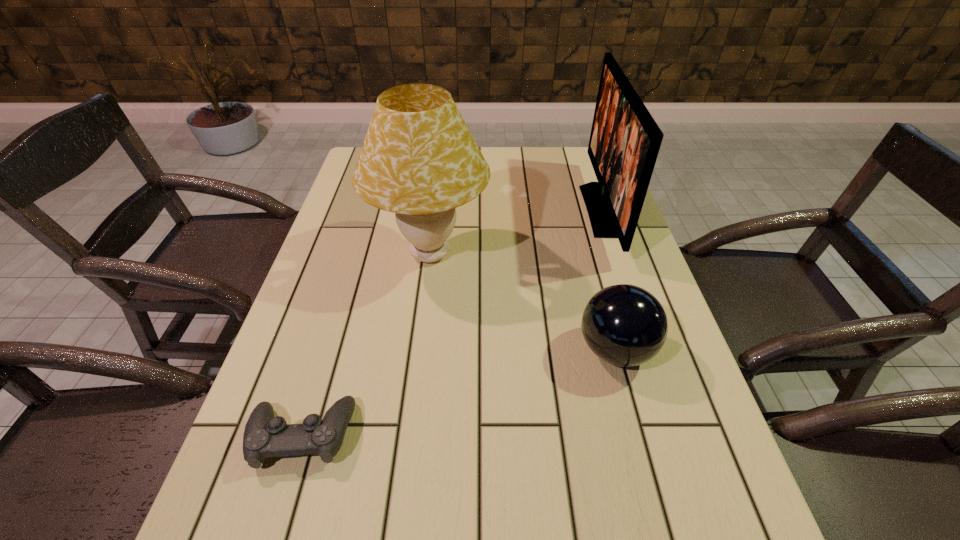
The width and height of the screenshot is (960, 540). Identify the location of free space at the far edge of the desktop. (526, 175).

Find the location of `free space at the left edge`. free space at the left edge is located at coordinates (206, 534).

Find the location of a particular element. free region at the right edge is located at coordinates (670, 436).

In order to click on empty location between the monitor and the lampshade in this screenshot , I will do `click(516, 232)`.

Identify the location of unoccupied area between the lampshade and the second shortest object. The width and height of the screenshot is (960, 540). (522, 302).

I want to click on vacant space that's between the monitor and the lampshade, so click(516, 232).

Where is `empty space that is in between the control and the second nearest object`? The width and height of the screenshot is (960, 540). empty space that is in between the control and the second nearest object is located at coordinates (459, 393).

This screenshot has width=960, height=540. What are the coordinates of `blank region between the monitor and the bowling ball` in the screenshot? It's located at (609, 280).

Locate an element on the screen. The image size is (960, 540). free space between the second nearest object and the lampshade is located at coordinates (522, 302).

Where is `unoccupied area between the nearest object and the lampshade`? The width and height of the screenshot is (960, 540). unoccupied area between the nearest object and the lampshade is located at coordinates (366, 345).